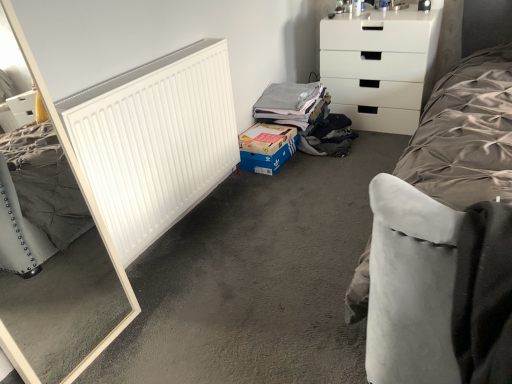
Question: Does smooth gray carpet at center turn towards white matte radiator at left?

Choices:
 (A) yes
 (B) no

Answer: (B)

Question: Is smooth gray carpet at center to the left of white matte radiator at left from the viewer's perspective?

Choices:
 (A) no
 (B) yes

Answer: (A)

Question: From a real-world perspective, is smooth gray carpet at center on white matte radiator at left?

Choices:
 (A) no
 (B) yes

Answer: (A)

Question: Is white matte radiator at left located within smooth gray carpet at center?

Choices:
 (A) yes
 (B) no

Answer: (B)

Question: Does smooth gray carpet at center have a larger size compared to white matte radiator at left?

Choices:
 (A) yes
 (B) no

Answer: (A)

Question: Is white glossy chest of drawers at upper right in front of or behind cardboard box at lower center in the image?

Choices:
 (A) front
 (B) behind

Answer: (A)

Question: From a real-world perspective, is white glossy chest of drawers at upper right above or below cardboard box at lower center?

Choices:
 (A) above
 (B) below

Answer: (A)

Question: Would you say white glossy chest of drawers at upper right is to the left or to the right of cardboard box at lower center in the picture?

Choices:
 (A) right
 (B) left

Answer: (A)

Question: Is white glossy chest of drawers at upper right spatially inside cardboard box at lower center, or outside of it?

Choices:
 (A) outside
 (B) inside

Answer: (A)

Question: Is smooth gray carpet at center spatially inside white glossy chest of drawers at upper right, or outside of it?

Choices:
 (A) outside
 (B) inside

Answer: (A)

Question: From a real-world perspective, is smooth gray carpet at center positioned above or below white glossy chest of drawers at upper right?

Choices:
 (A) above
 (B) below

Answer: (B)

Question: Looking at their shapes, would you say smooth gray carpet at center is wider or thinner than white glossy chest of drawers at upper right?

Choices:
 (A) wide
 (B) thin

Answer: (A)

Question: Considering the positions of point (282, 365) and point (345, 66), is point (282, 365) closer or farther from the camera than point (345, 66)?

Choices:
 (A) farther
 (B) closer

Answer: (B)

Question: Is smooth gray carpet at center spatially inside cardboard box at lower center, or outside of it?

Choices:
 (A) inside
 (B) outside

Answer: (B)

Question: From their relative heights in the image, would you say smooth gray carpet at center is taller or shorter than cardboard box at lower center?

Choices:
 (A) tall
 (B) short

Answer: (B)